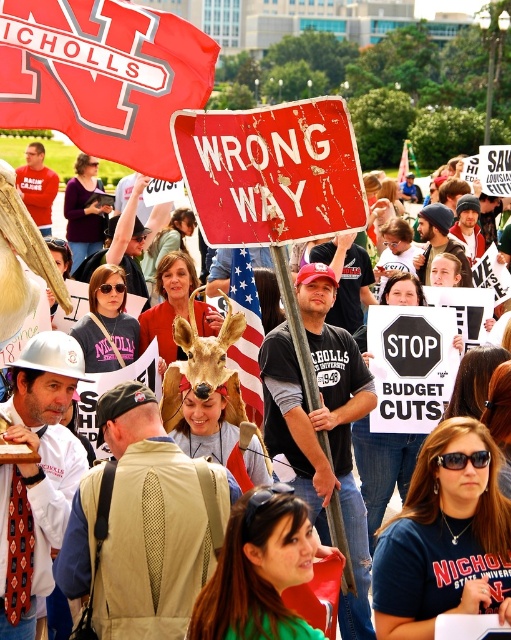
Looking at this image, who is taller, rusty metal sign at center or american flag at center?

Standing taller between the two is american flag at center.

Who is higher up, rusty metal sign at center or american flag at center?

rusty metal sign at center is above.

Image resolution: width=511 pixels, height=640 pixels. What do you see at coordinates (270, 172) in the screenshot?
I see `rusty metal sign at center` at bounding box center [270, 172].

The width and height of the screenshot is (511, 640). I want to click on rusty metal sign at center, so click(270, 172).